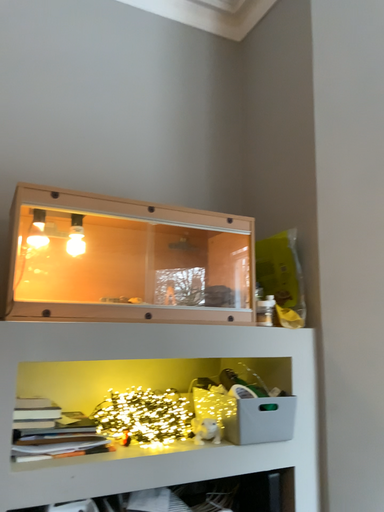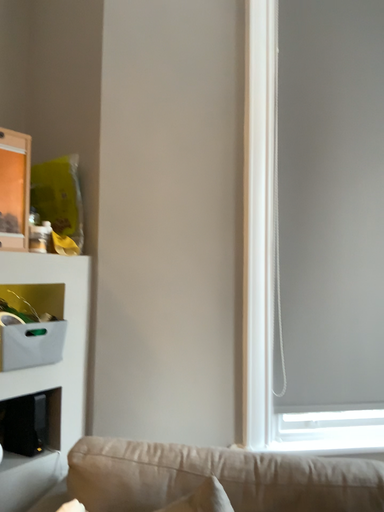
Question: Which way did the camera rotate in the video?

Choices:
 (A) rotated downward
 (B) rotated upward

Answer: (A)